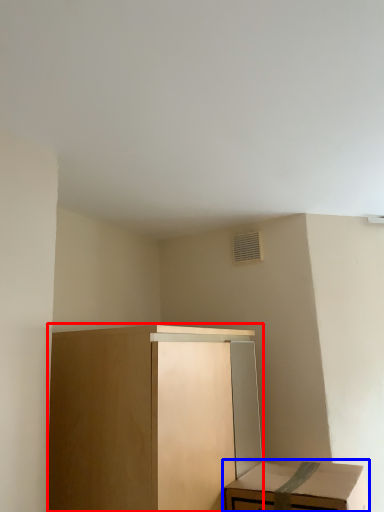
Question: Which object is further to the camera taking this photo, cabinetry (highlighted by a red box) or table (highlighted by a blue box)?

Choices:
 (A) cabinetry
 (B) table

Answer: (B)